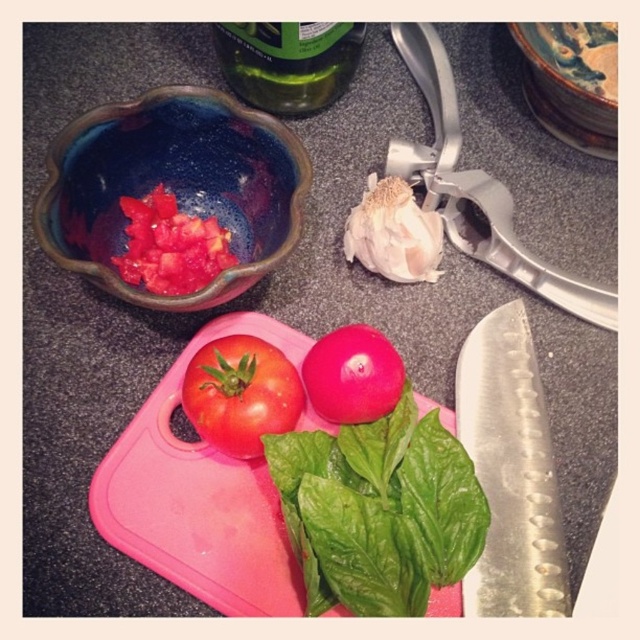
Question: Which object is the farthest from the green glass bottle at upper center?

Choices:
 (A) silver metallic knife at lower right
 (B) blue glossy bowl at upper left
 (C) pink plastic cutting board at center
 (D) red matte tomato at center

Answer: (A)

Question: Which point is closer to the camera?

Choices:
 (A) (272, 604)
 (B) (298, 67)
 (C) (518, 596)
 (D) (371, 330)

Answer: (A)

Question: Which of the following is the farthest from the observer?

Choices:
 (A) blue glossy bowl at upper left
 (B) red matte tomato at center
 (C) green leafy basil at center

Answer: (B)

Question: Does pink plastic cutting board at center have a larger size compared to silver metallic knife at lower right?

Choices:
 (A) no
 (B) yes

Answer: (B)

Question: In this image, where is red matte tomato at center located relative to glossy red tomato at center?

Choices:
 (A) below
 (B) above

Answer: (A)

Question: Observing the image, what is the correct spatial positioning of blue glossy bowl at upper left in reference to silver metallic knife at lower right?

Choices:
 (A) left
 (B) right

Answer: (A)